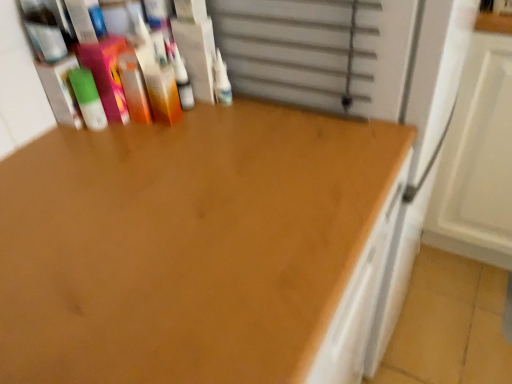
Where is `wooden table at center`? The height and width of the screenshot is (384, 512). wooden table at center is located at coordinates [x=186, y=245].

Image resolution: width=512 pixels, height=384 pixels. What do you see at coordinates (186, 245) in the screenshot?
I see `wooden table at center` at bounding box center [186, 245].

What is the approximate width of wooden table at center?

wooden table at center is 24.07 inches in width.

Where is `wooden table at center`? wooden table at center is located at coordinates (186, 245).